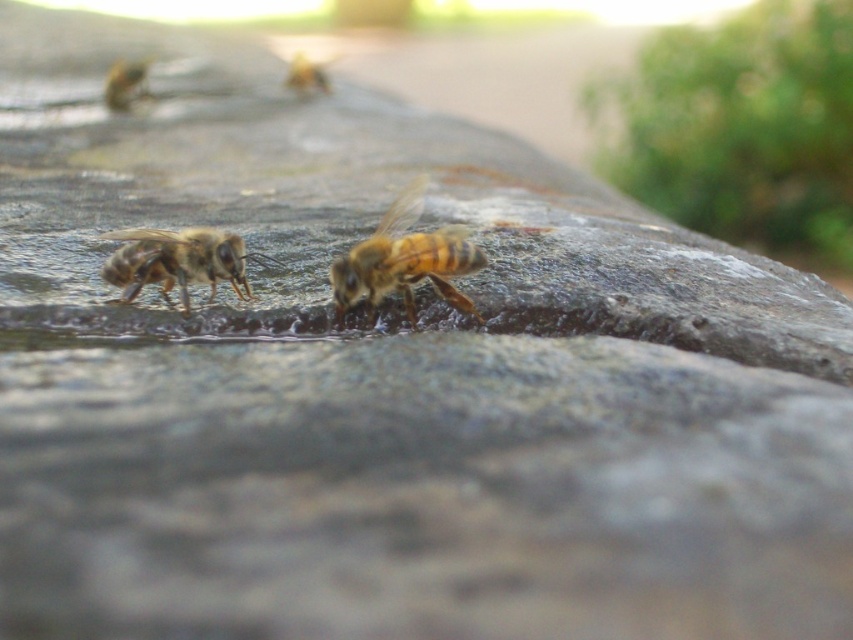
Question: Which of the following is the closest to the observer?

Choices:
 (A) (318, 61)
 (B) (183, 264)

Answer: (B)

Question: Is brown fuzzy bee at center closer to camera compared to translucent golden honeybee at upper left?

Choices:
 (A) no
 (B) yes

Answer: (B)

Question: Can you confirm if yellow-brown fuzzy bee at center is positioned below translucent golden bee at upper center?

Choices:
 (A) yes
 (B) no

Answer: (A)

Question: Which of the following is the closest to the observer?

Choices:
 (A) (376, 246)
 (B) (312, 90)

Answer: (A)

Question: Which of the following is the closest to the observer?

Choices:
 (A) (299, 83)
 (B) (105, 99)
 (C) (149, 253)

Answer: (C)

Question: Can you confirm if brown fuzzy bee at center is smaller than translucent golden honeybee at upper left?

Choices:
 (A) no
 (B) yes

Answer: (B)